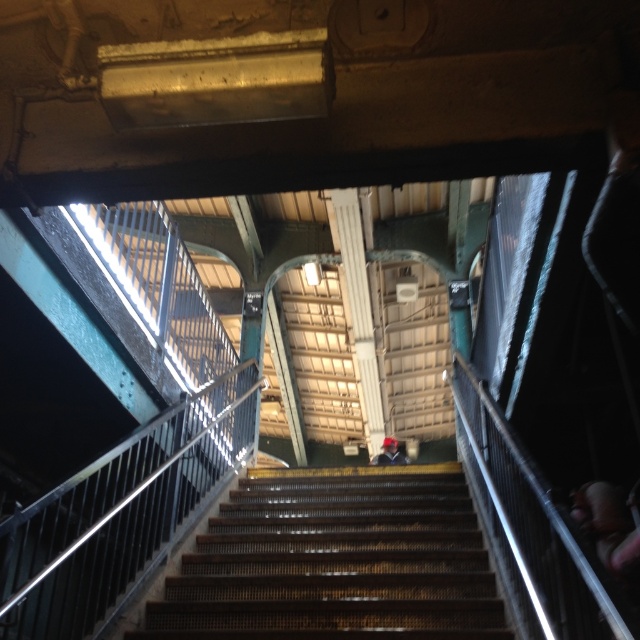
You are a painter who needs to reach a high ceiling beam in the industrial space. You have a ladder that is the same height as the dark blue fabric jacket at center. Can you use the ladder to reach the ceiling beam if you place it on the metallic brown stairs at center?

The metallic brown stairs at center is not as tall as the dark blue fabric jacket at center, so the ladder would be taller than the stairs. Therefore, placing the ladder on the metallic brown stairs at center might provide enough height to reach the ceiling beam.

You are a delivery person carrying a large package and need to navigate through the space. You see the metallic brown stairs at center and the dark blue fabric jacket at center. Which object should you avoid stepping on to ensure your package stays clean?

You should avoid stepping on the dark blue fabric jacket at center because the metallic brown stairs at center is larger in size and more appropriate for walking on.